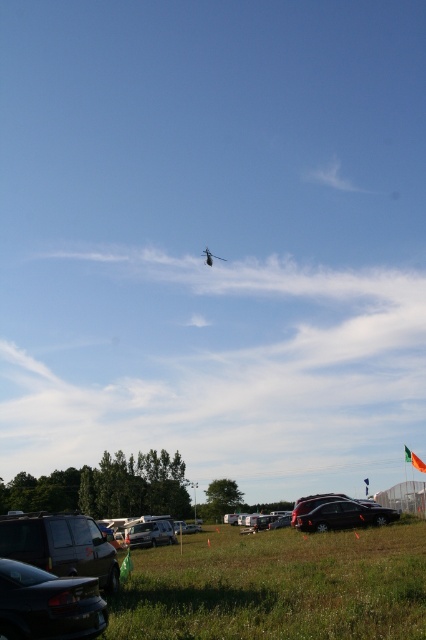
Between shiny black sedan at lower left and silver metallic van at center, which one has more height?

silver metallic van at center

Based on the photo, is shiny black sedan at lower left positioned in front of silver metallic van at center?

Yes, it is.

Which is behind, point (69, 604) or point (158, 525)?

Positioned behind is point (158, 525).

At what (x,y) coordinates should I click in order to perform the action: click on shiny black sedan at lower left. Please return your answer as a coordinate pair (x, y). Looking at the image, I should click on (48, 604).

Which of these two, shiny black sedan at lower left or satin black suv at lower center, stands taller?

satin black suv at lower center

Who is more forward, (2, 600) or (319, 509)?

Point (2, 600) is in front.

Locate an element on the screen. The image size is (426, 640). shiny black sedan at lower left is located at coordinates (48, 604).

Is shiny black sedan at lower left shorter than metallic silver helicopter at upper center?

Correct, shiny black sedan at lower left is not as tall as metallic silver helicopter at upper center.

Is point (37, 577) positioned in front of point (207, 260)?

That is True.

Where is `shiny black sedan at lower left`? Image resolution: width=426 pixels, height=640 pixels. shiny black sedan at lower left is located at coordinates (48, 604).

Locate an element on the screen. Image resolution: width=426 pixels, height=640 pixels. shiny black sedan at lower left is located at coordinates (48, 604).